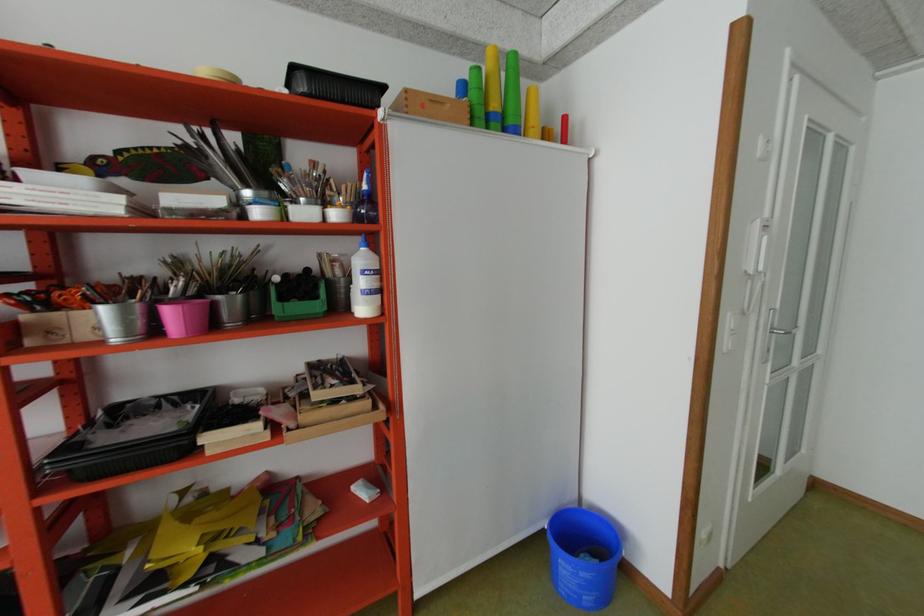
Where would you pull the silver door handle? Please return your answer as a coordinate pair (x, y).

(782, 331)